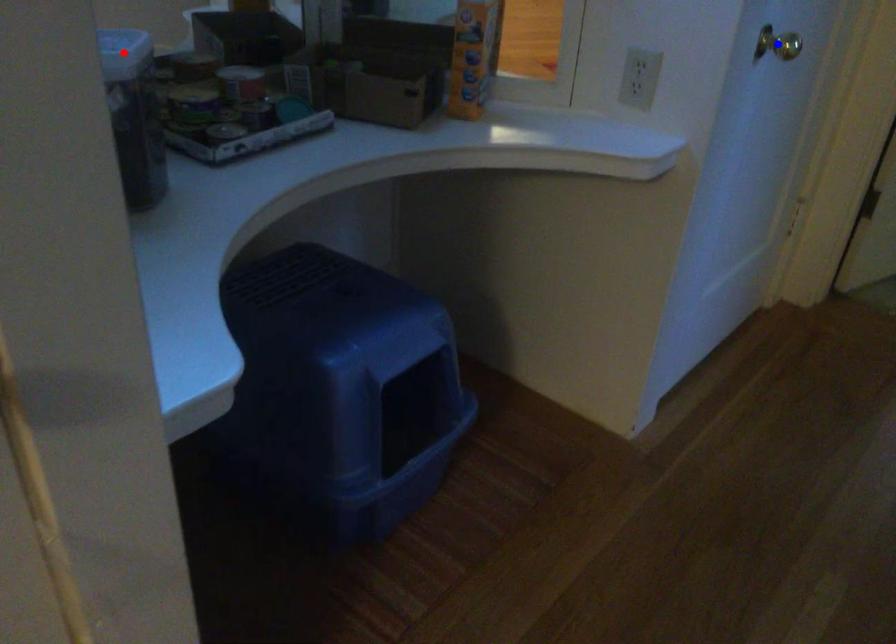
Question: Two points are marked on the image. Which point is closer to the camera?

Choices:
 (A) Blue point is closer.
 (B) Red point is closer.

Answer: (B)